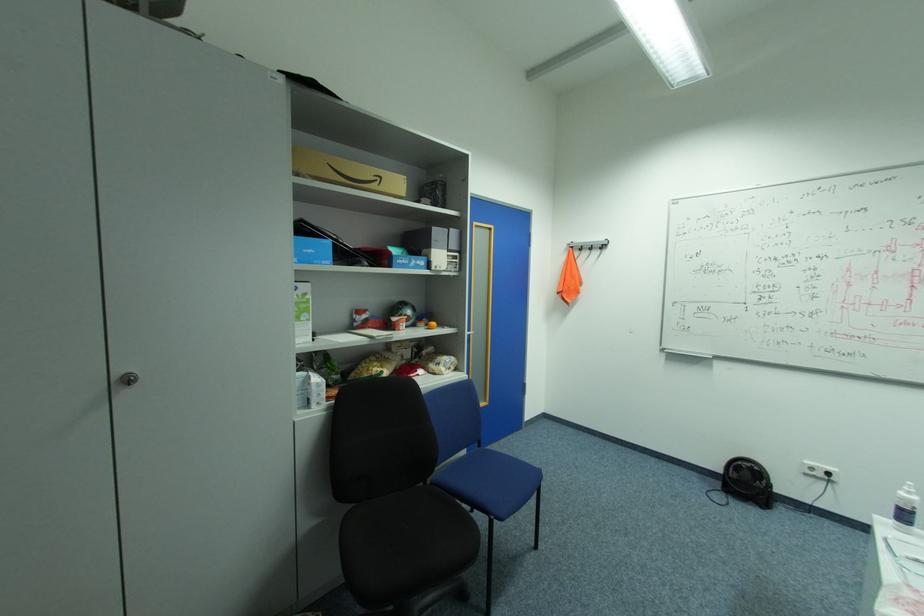
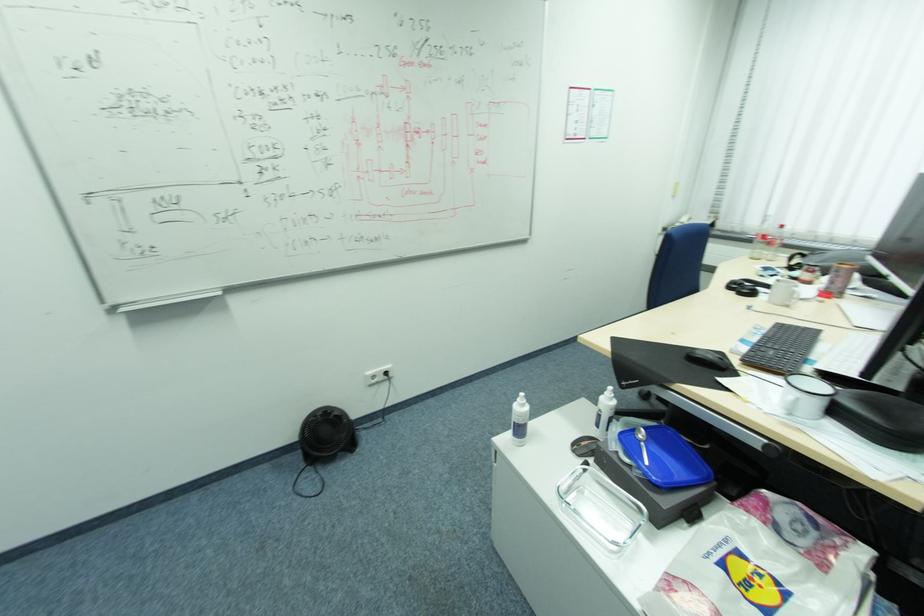
Locate, in the second image, the point that corresponds to point 724,484 in the first image.

(304, 456)